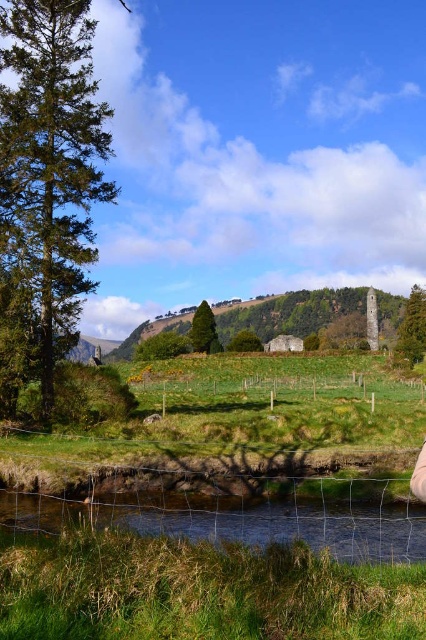
You are standing at the edge of the clear water at lower center and want to walk to the green grassy fence at center. Which direction should you move to reach the fence?

The clear water at lower center has a lesser height compared to the green grassy fence at center, so you should move upward to reach the green grassy fence at center.